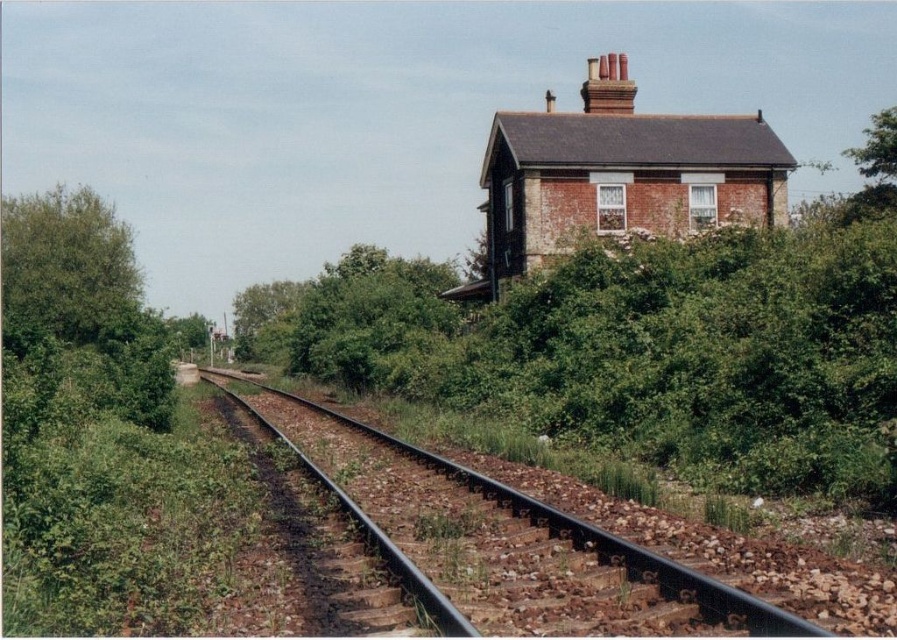
Question: Can you confirm if green leafy tree at left is positioned below black metal train track at lower left?

Choices:
 (A) no
 (B) yes

Answer: (A)

Question: Which object is positioned closest to the red brick chimney at upper center?

Choices:
 (A) green leafy tree at left
 (B) green leafy tree at center

Answer: (A)

Question: Where is black metal train track at lower left located in relation to red brick chimney at upper center in the image?

Choices:
 (A) right
 (B) left

Answer: (B)

Question: Is green leafy tree at left behind green leafy tree at center?

Choices:
 (A) no
 (B) yes

Answer: (A)

Question: Which object is the closest to the green leafy tree at left?

Choices:
 (A) red brick chimney at upper center
 (B) green leafy tree at center
 (C) black metal train track at lower left

Answer: (C)

Question: Which point is closer to the camera?

Choices:
 (A) (575, 525)
 (B) (109, 305)

Answer: (A)